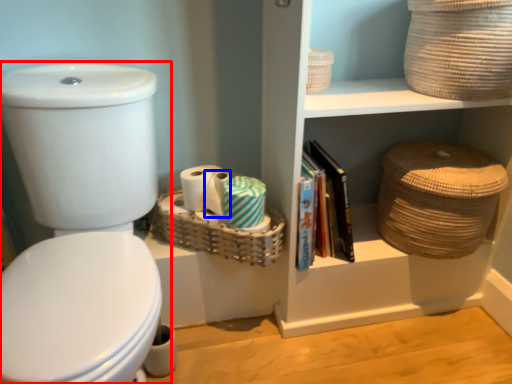
Question: Which of the following is the farthest to the observer, toilet (highlighted by a red box) or toilet paper (highlighted by a blue box)?

Choices:
 (A) toilet
 (B) toilet paper

Answer: (B)